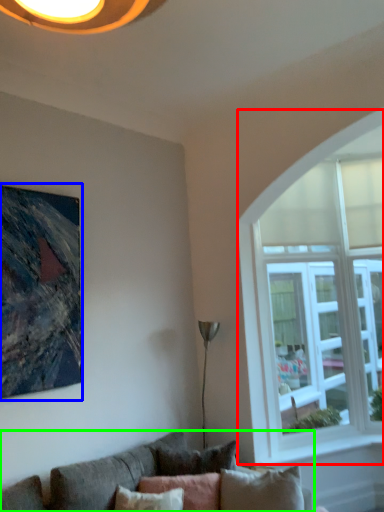
Question: Which is farther away from window (highlighted by a red box)? picture frame (highlighted by a blue box) or studio couch (highlighted by a green box)?

Choices:
 (A) picture frame
 (B) studio couch

Answer: (A)